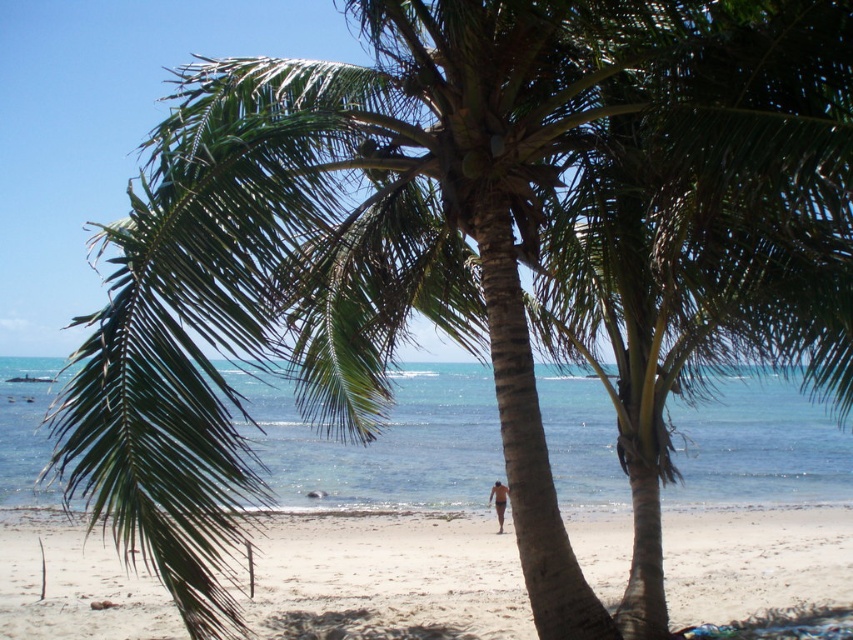
How far apart are sandy beach at lower center and clear blue water at center?

A distance of 4.50 meters exists between sandy beach at lower center and clear blue water at center.

What do you see at coordinates (392, 573) in the screenshot?
I see `sandy beach at lower center` at bounding box center [392, 573].

Where is `sandy beach at lower center`? The height and width of the screenshot is (640, 853). sandy beach at lower center is located at coordinates (392, 573).